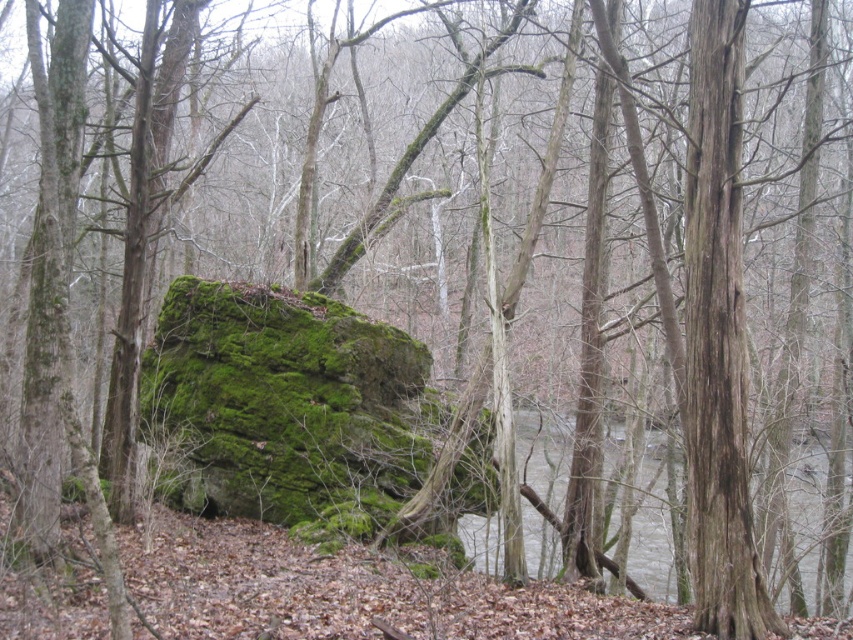
You are navigating through the forest and need to determine the order of two points marked on your map. The points are labeled as point (323,420) and point (717,77). Based on their positions in the image, which point is closer to you?

Point (717,77) is closer to you because it is in front of point (323,420) according to the image description.

You are standing at the base of the brown rough tree trunk at right. You want to walk to the large moss covered rock in the foreground. How many steps would you need to take if each step covers 3 feet?

The distance between the brown rough tree trunk at right and the large moss covered rock is 23.81 feet. Since each step covers 3 feet, you would need approximately 8 steps because 23.81 divided by 3 is about 7.936, which rounds up to 8 steps.